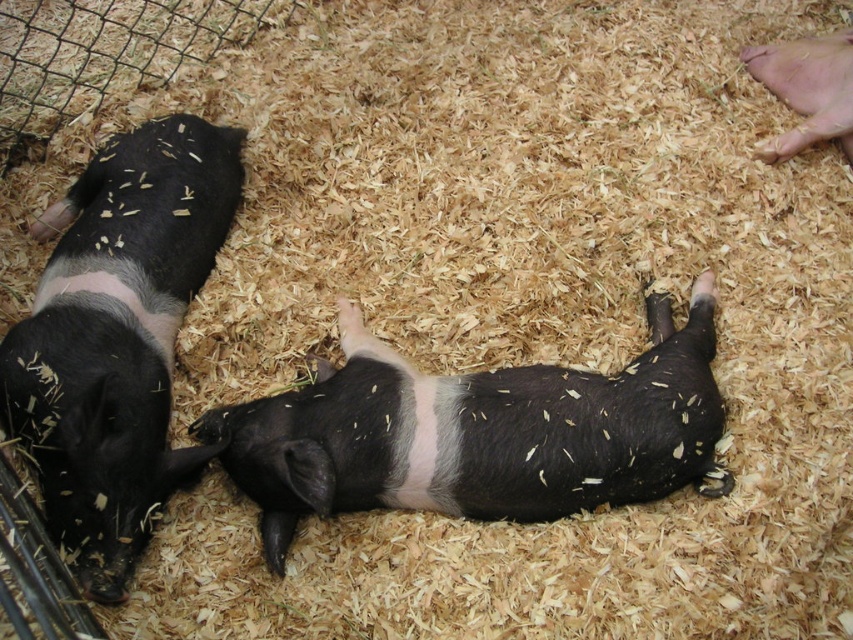
Based on the photo, you are a caretaker who needs to ensure each piglet has enough space in their enclosure. Given that the enclosure is 1.2 meters wide, and the black matte pig at center and black matte pig at left are the only occupants, can both pigs fit side by side without overlapping?

The black matte pig at center is wider than the black matte pig at left. Assuming the combined width of both pigs is less than 1.2 meters, they can fit side by side. However, without exact measurements, we can only confirm that the center pig is wider, but their total width must be under 1.2 meters to fit.

You are a farmer checking on the piglets in their enclosure. You need to move the black matte pig at left and the black matte pig at upper right to a larger pen. Which pig should you move first if you want to reach the one behind it?

The black matte pig at left is in front of the black matte pig at upper right, so you should move the black matte pig at left first to access the one behind it.